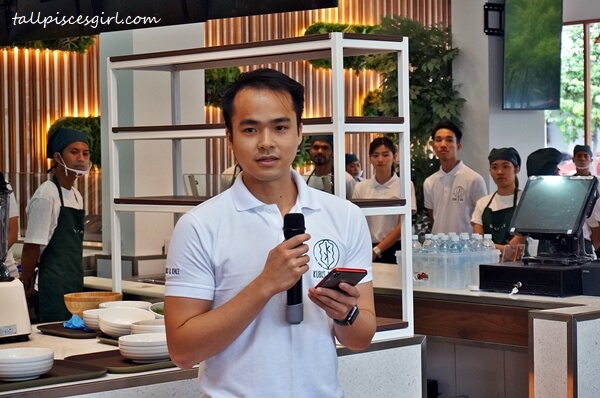
The width and height of the screenshot is (600, 398). In order to click on tray in this screenshot , I will do `click(65, 368)`, `click(108, 357)`, `click(76, 331)`.